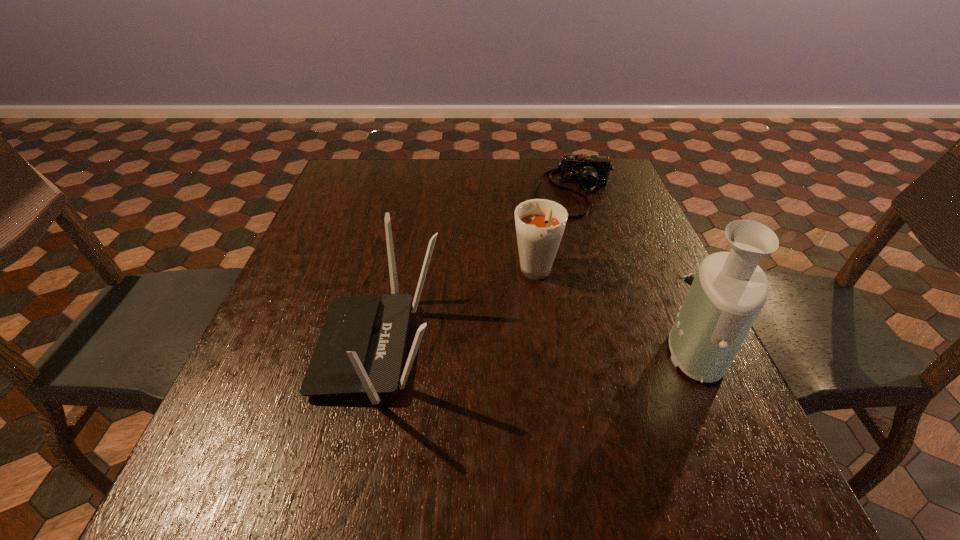
You are a GUI agent. You are given a task and a screenshot of the screen. Output one action in this format:
    pyautogui.click(x=<x>, y=<y>)
    Task: Click on the object that is at the near left corner
    The height and width of the screenshot is (540, 960).
    Given the screenshot: What is the action you would take?
    pyautogui.click(x=360, y=348)

Find the location of a particular element. This screenshot has width=960, height=540. object that is at the far right corner is located at coordinates (588, 171).

The image size is (960, 540). In order to click on free region at the far edge in this screenshot , I will do `click(398, 163)`.

You are a GUI agent. You are given a task and a screenshot of the screen. Output one action in this format:
    pyautogui.click(x=<x>, y=<y>)
    Task: Click on the vacant space at the near edge
    This screenshot has height=540, width=960.
    Given the screenshot: What is the action you would take?
    pyautogui.click(x=586, y=433)

Locate an element on the screen. This screenshot has width=960, height=540. vacant space at the left edge is located at coordinates 273,349.

The image size is (960, 540). I want to click on free space at the far left corner, so click(368, 174).

The height and width of the screenshot is (540, 960). In order to click on free location at the near left corner of the desktop in this screenshot , I will do `click(295, 447)`.

This screenshot has height=540, width=960. Identify the location of vacant space at the far right corner of the desktop. (624, 194).

Locate an element on the screen. The height and width of the screenshot is (540, 960). free space between the farthest object and the tallest object is located at coordinates tap(638, 272).

The height and width of the screenshot is (540, 960). I want to click on unoccupied position between the camera and the juicer, so click(x=638, y=272).